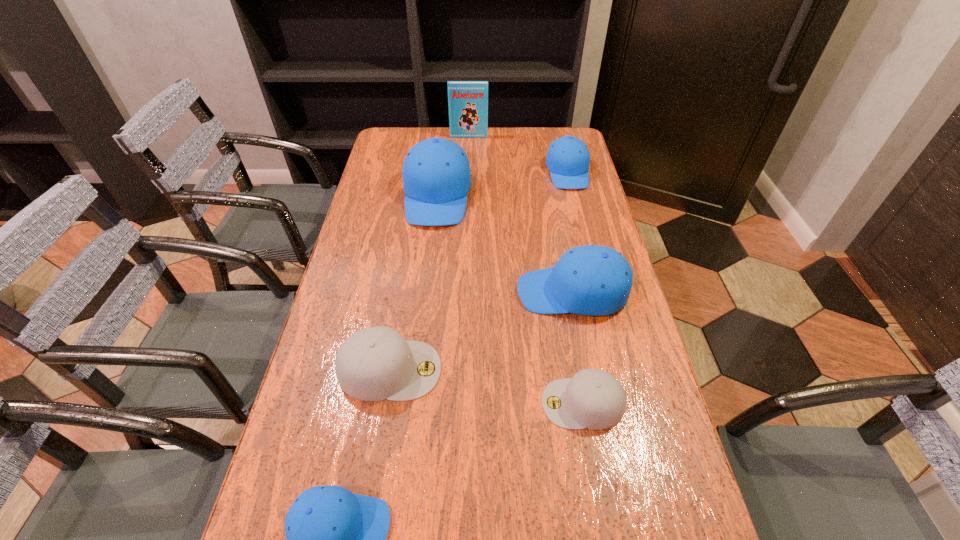
What are the coordinates of `cap that is at the far edge` in the screenshot? It's located at (568, 158).

You are a GUI agent. You are given a task and a screenshot of the screen. Output one action in this format:
    pyautogui.click(x=<x>, y=<y>)
    Task: Click on the object at the far right corner
    The image size is (960, 540).
    Given the screenshot: What is the action you would take?
    pyautogui.click(x=568, y=158)

Identify the location of vacant space at the left edge of the desktop. (386, 177).

This screenshot has width=960, height=540. In the image, there is a desktop. In order to click on vacant space at the right edge in this screenshot , I will do `click(605, 220)`.

This screenshot has width=960, height=540. I want to click on vacant space at the far left corner of the desktop, so click(392, 151).

The image size is (960, 540). I want to click on free space between the second tallest cap and the right gray cap, so click(578, 348).

Find the location of a particular element. This screenshot has width=960, height=540. vacant region between the third biggest blue cap and the biggest blue cap is located at coordinates (502, 184).

Where is `free spot between the bigger gray cap and the third biggest blue cap`? The image size is (960, 540). free spot between the bigger gray cap and the third biggest blue cap is located at coordinates (479, 271).

I want to click on free space between the third biggest blue cap and the fourth nearest cap, so click(x=570, y=232).

In order to click on free space between the sixth shortest object and the right gray cap in this screenshot , I will do pyautogui.click(x=510, y=300).